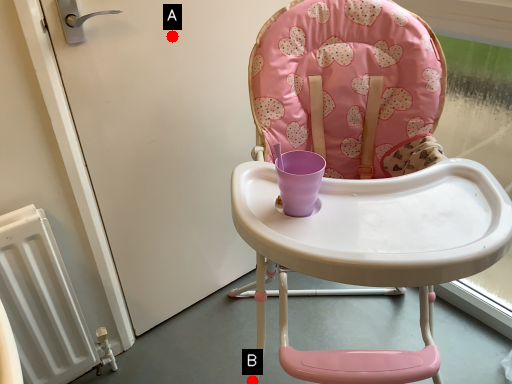
Question: Two points are circled on the image, labeled by A and B beside each circle. Which point is farther to the camera?

Choices:
 (A) A is further
 (B) B is further

Answer: (A)